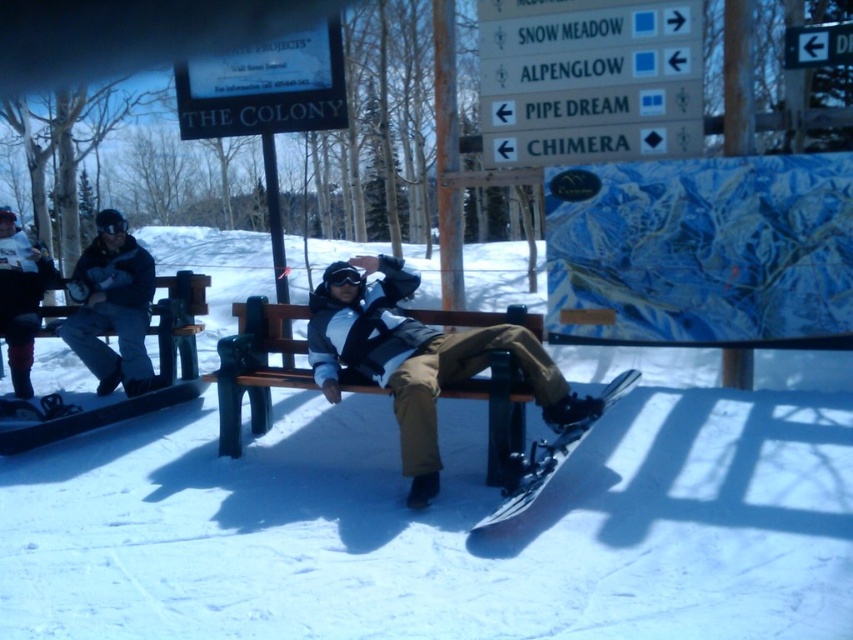
You are a photographer trying to capture both the white matte snowboard at center and the brushed metal snowboard at left in a single shot. Based on their positions, which snowboard would appear closer to the camera in the photo?

The white matte snowboard at center appears closer to the camera because it is positioned in front of the brushed metal snowboard at left.

You are planning to place a small flag at the location marked by point (450, 518) in the image. What object will the flag be placed near?

The flag will be placed near the white matte snowboard at center, as the point (450, 518) marks its location.